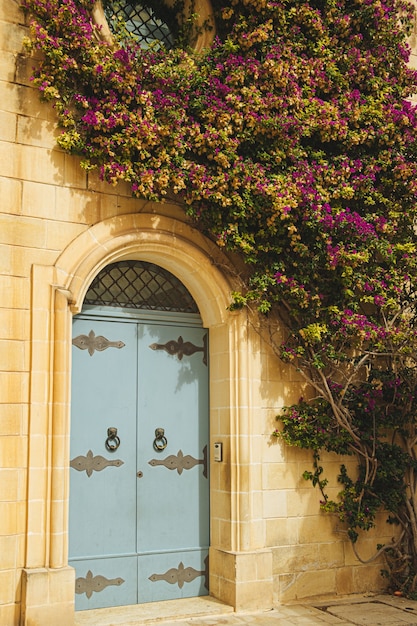
Identify the location of white brick wall. Image resolution: width=417 pixels, height=626 pixels. (9, 206).